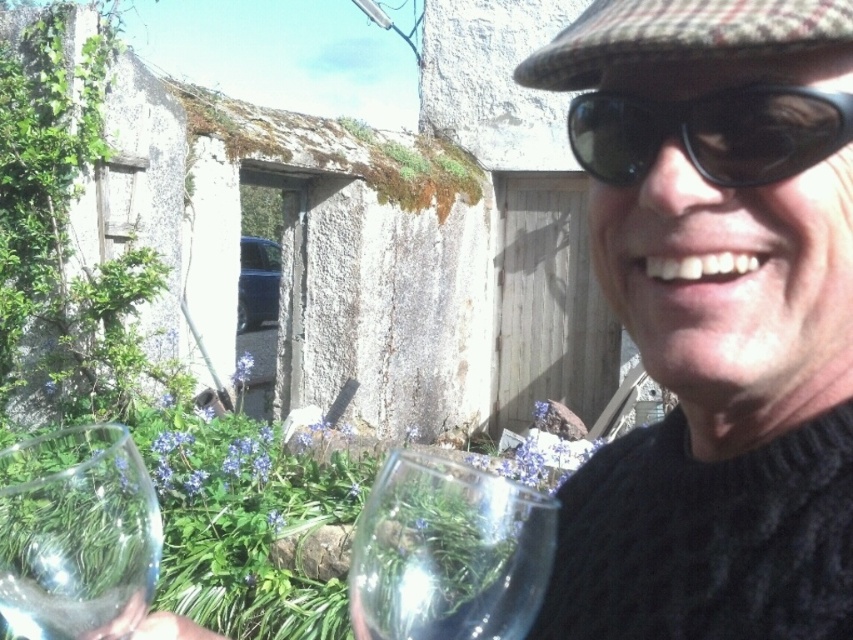
Question: Is transparent glass at lower left thinner than black plastic goggles at upper right?

Choices:
 (A) no
 (B) yes

Answer: (A)

Question: From the image, what is the correct spatial relationship of transparent glass at lower center in relation to transparent glass at lower left?

Choices:
 (A) below
 (B) above

Answer: (B)

Question: Which is farther from the transparent glass at lower center?

Choices:
 (A) black plastic goggles at upper right
 (B) transparent glass at lower left

Answer: (B)

Question: Can you confirm if transparent glass at lower center is positioned to the right of transparent glass at lower left?

Choices:
 (A) yes
 (B) no

Answer: (A)

Question: Which point is closer to the camera?

Choices:
 (A) (402, 458)
 (B) (51, 492)
 (C) (755, 154)

Answer: (C)

Question: Which of the following is the farthest from the observer?

Choices:
 (A) (88, 621)
 (B) (440, 465)

Answer: (B)